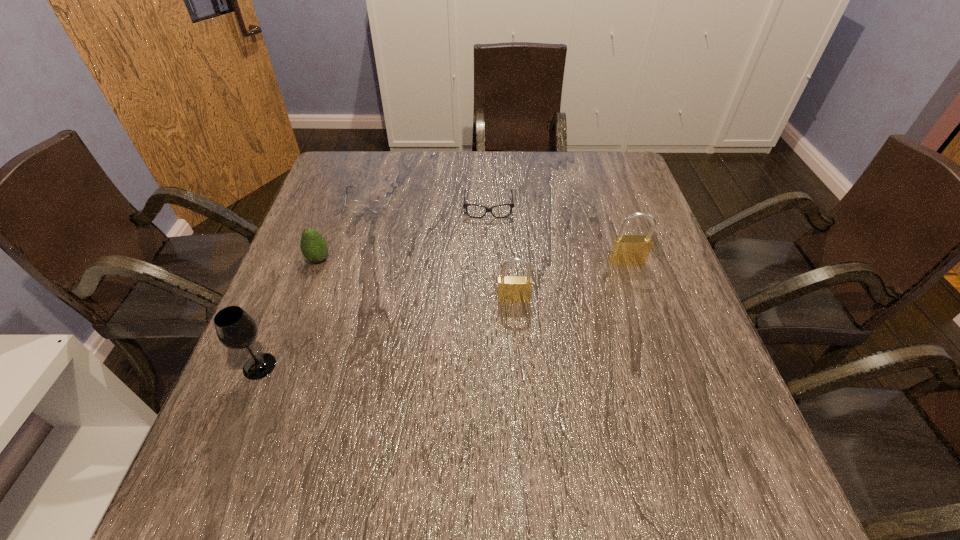
At what (x,y) coordinates should I click in order to perform the action: click on vacant space at the far edge of the desktop. Please return your answer as a coordinate pair (x, y). Looking at the image, I should click on (396, 151).

Identify the location of vacant area at the near edge of the desktop. (395, 434).

At what (x,y) coordinates should I click in order to perform the action: click on free region at the left edge. Please return your answer as a coordinate pair (x, y). Looking at the image, I should click on click(313, 322).

I want to click on vacant space at the right edge of the desktop, so click(x=679, y=378).

Locate an element on the screen. This screenshot has height=540, width=960. vacant region at the far left corner of the desktop is located at coordinates point(353,185).

This screenshot has height=540, width=960. In the image, there is a desktop. Find the location of `vacant space at the near right corner`. vacant space at the near right corner is located at coordinates (727, 399).

Locate an element on the screen. free space between the left spectacles and the right spectacles is located at coordinates (430, 204).

What are the coordinates of `vacant space in between the taller padlock and the right spectacles` in the screenshot? It's located at (558, 235).

The height and width of the screenshot is (540, 960). I want to click on free space that is in between the left spectacles and the shorter padlock, so click(443, 249).

Locate an element on the screen. Image resolution: width=960 pixels, height=540 pixels. free space that is in between the right spectacles and the avocado is located at coordinates (403, 234).